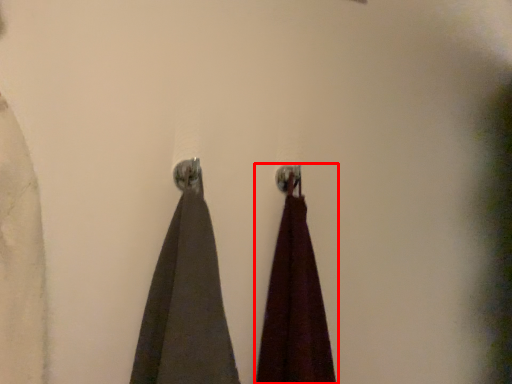
Question: From the image's perspective, what is the correct spatial positioning of curtain (annotated by the red box) in reference to curtain?

Choices:
 (A) above
 (B) below

Answer: (B)